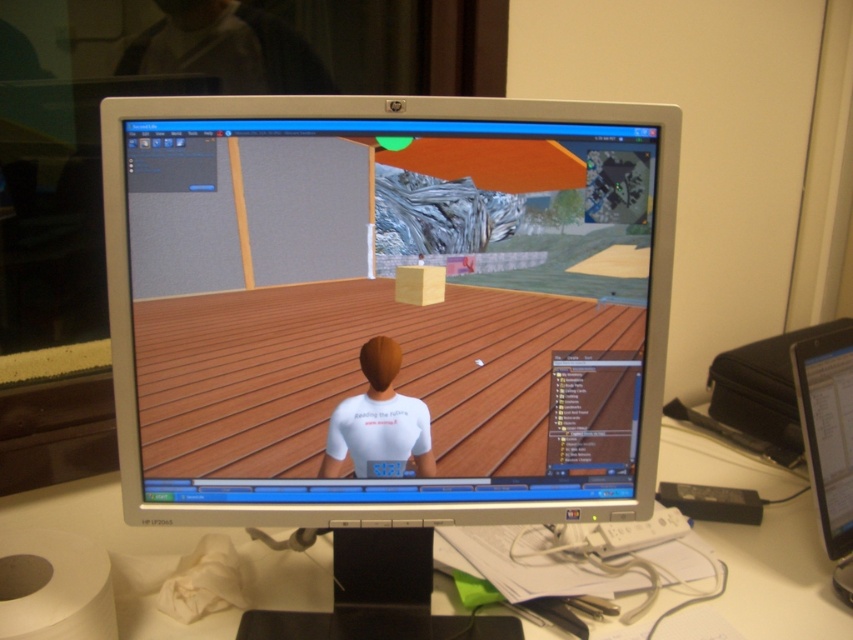
Question: Which point appears closest to the camera in this image?

Choices:
 (A) (554, 236)
 (B) (727, 618)

Answer: (A)

Question: Based on their relative distances, which object is farther from the silver metallic monitor at center?

Choices:
 (A) white matte shirt at center
 (B) black plastic monitor at right
 (C) white paper at lower center

Answer: (B)

Question: Which of these objects is positioned farthest from the white paper at lower center?

Choices:
 (A) silver metallic monitor at center
 (B) black plastic monitor at right

Answer: (A)

Question: Is silver metallic monitor at center further to the viewer compared to black plastic monitor at right?

Choices:
 (A) no
 (B) yes

Answer: (A)

Question: Is silver metallic monitor at center in front of white matte shirt at center?

Choices:
 (A) yes
 (B) no

Answer: (A)

Question: Is white paper at lower center below black plastic monitor at right?

Choices:
 (A) no
 (B) yes

Answer: (B)